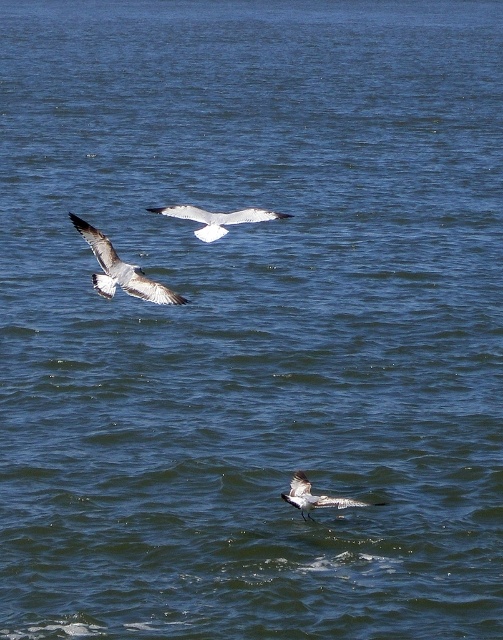
You are standing on a boat and see the white matte bird at center and the speckled feathered bird at lower center. If you want to throw a small fish to the closer bird, which one should you aim for?

The speckled feathered bird at lower center is closer to you because it is positioned lower in the image and appears larger, indicating it is nearer than the white matte bird at center.

You are observing two birds in the sky. You see a white matte bird at center and a speckled feathered bird at lower center. Which bird appears bigger in the image?

The white matte bird at center appears bigger than the speckled feathered bird at lower center in the image.